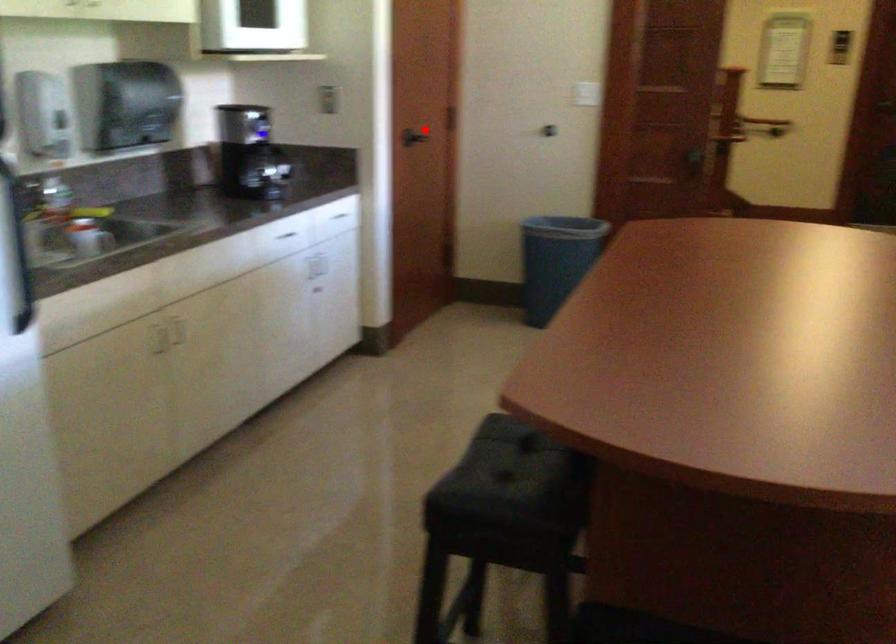
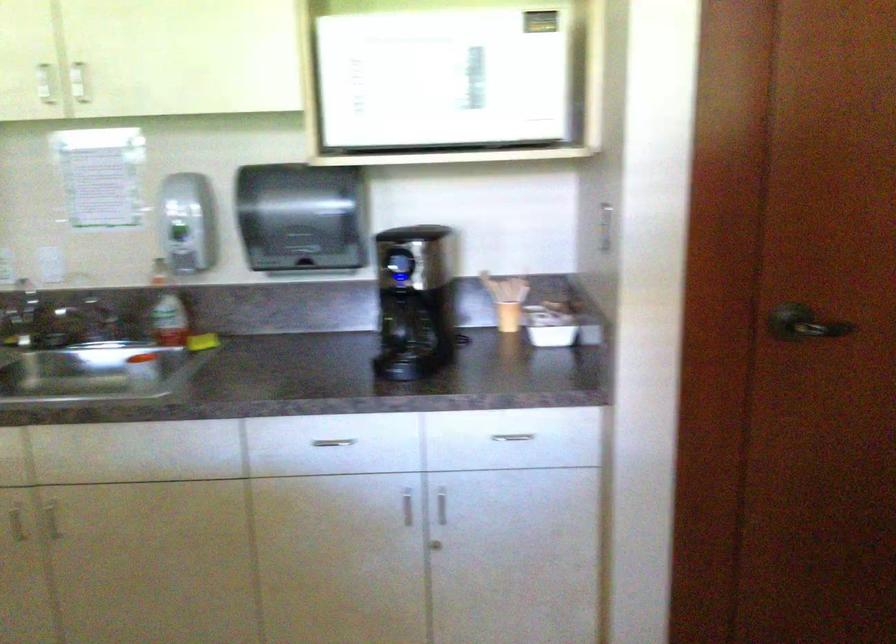
In the second image, find the point that corresponds to the highlighted location in the first image.

(803, 323)